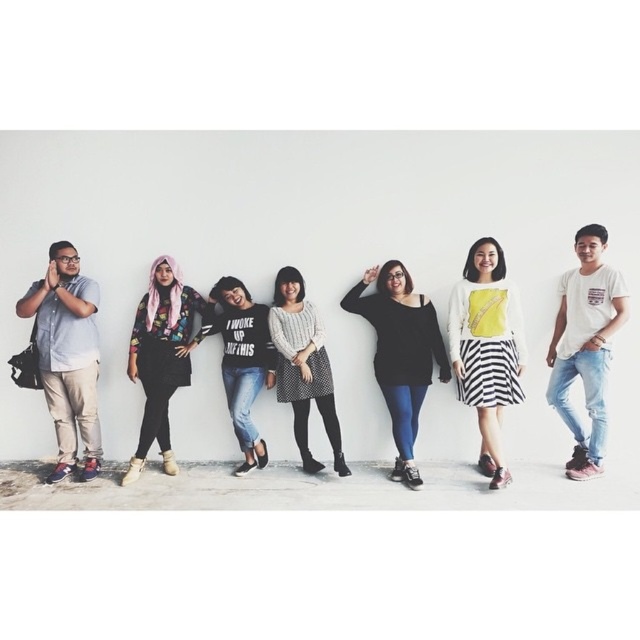
Can you confirm if multicolored fabric hijab at center is smaller than black cotton t-shirt at center?

Actually, multicolored fabric hijab at center might be larger than black cotton t-shirt at center.

Between point (147, 433) and point (246, 464), which one is positioned behind?

Positioned behind is point (246, 464).

The width and height of the screenshot is (640, 640). I want to click on multicolored fabric hijab at center, so click(161, 356).

Does white cotton t-shirt at right have a larger size compared to black matte sweater at center?

No.

Does point (570, 460) lie behind point (374, 300)?

Yes, it is behind point (374, 300).

Find the location of a particular element. This screenshot has height=640, width=640. white cotton t-shirt at right is located at coordinates (586, 346).

Is point (595, 269) closer to camera compared to point (502, 468)?

That is False.

In the scene shown: Measure the distance between point [568,282] and camera.

The distance of point [568,282] from camera is 4.04 meters.

Where is `white cotton t-shirt at right`? white cotton t-shirt at right is located at coordinates (586, 346).